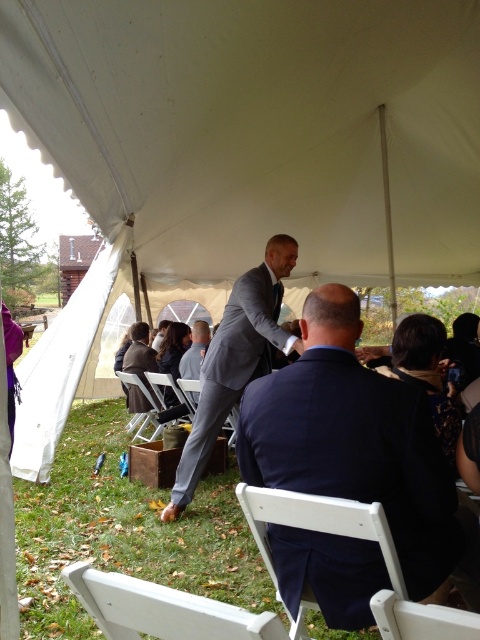
Question: Which of these objects is positioned farthest from the navy blue suit at center?

Choices:
 (A) white plastic chair at lower right
 (B) metallic silver chair at lower center
 (C) gray suit at center
 (D) matte gray suit at center

Answer: (C)

Question: Estimate the real-world distances between objects in this image. Which object is farther from the white plastic chair at lower left?

Choices:
 (A) metallic silver chair at lower center
 (B) white plastic chair at center
 (C) white wood chair at lower center
 (D) gray suit at center

Answer: (C)

Question: Which object is farther from the camera taking this photo?

Choices:
 (A) metallic silver chair at lower center
 (B) gray suit at center
 (C) white plastic chair at lower right

Answer: (B)

Question: Can you confirm if white plastic chair at lower right is positioned below metallic silver chair at lower center?

Choices:
 (A) no
 (B) yes

Answer: (A)

Question: Is white plastic chair at lower center positioned in front of white plastic chair at center?

Choices:
 (A) yes
 (B) no

Answer: (A)

Question: Where is white wood chair at lower center located in relation to white plastic chair at lower right in the image?

Choices:
 (A) left
 (B) right

Answer: (A)